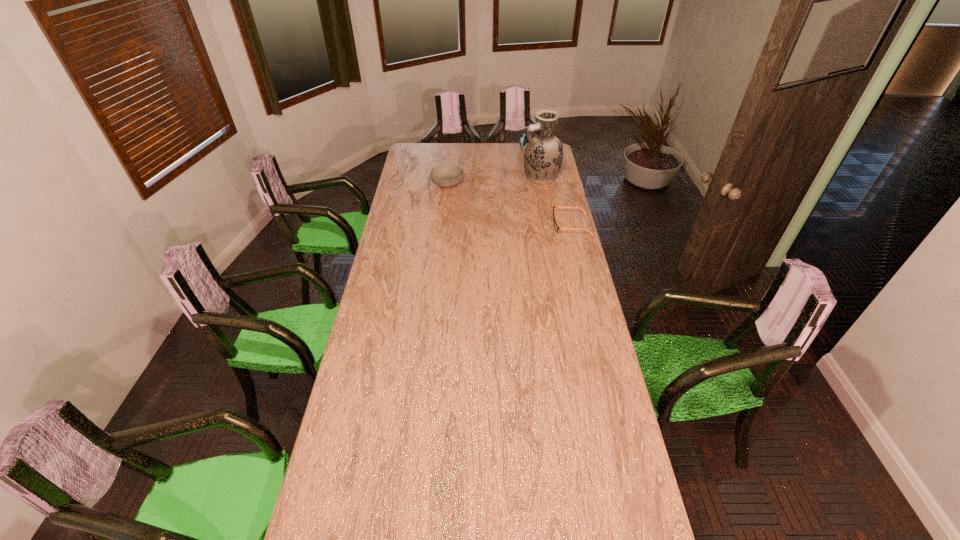
Where is `free space on the desktop that is between the bowl and the nearest object and is positioned with the handle on the side of the vase`? The height and width of the screenshot is (540, 960). free space on the desktop that is between the bowl and the nearest object and is positioned with the handle on the side of the vase is located at coordinates (491, 198).

At what (x,y) coordinates should I click in order to perform the action: click on vacant space on the desktop that is between the leftmost object and the nearest object and is positioned on the ear cups of the third shortest object. Please return your answer as a coordinate pair (x, y). The image size is (960, 540). Looking at the image, I should click on (501, 201).